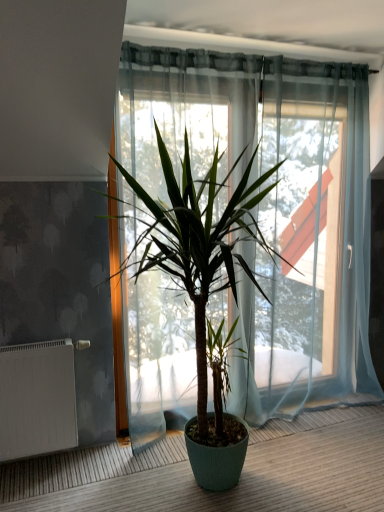
Locate an element on the screen. free point below green matte plant at center (from a real-world perspective) is located at coordinates (192, 480).